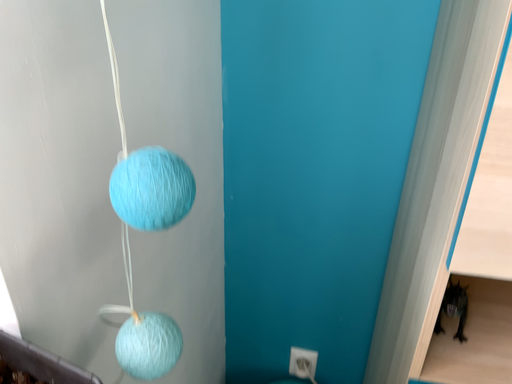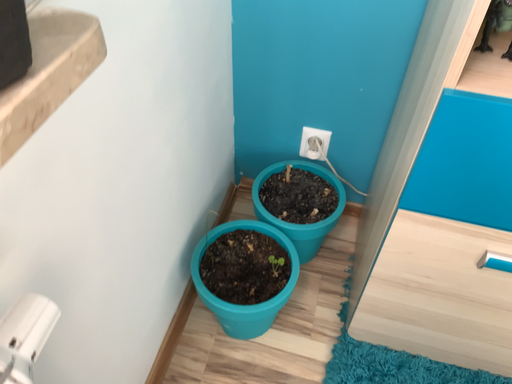
Question: Which way did the camera rotate in the video?

Choices:
 (A) rotated downward
 (B) rotated upward

Answer: (A)